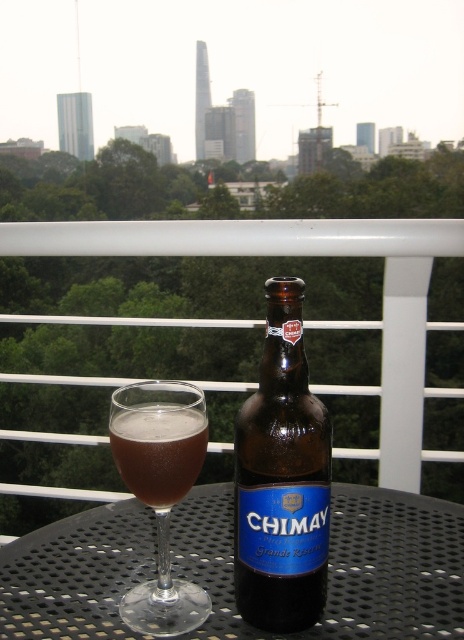
Question: Is brown glass bottle at center to the left of brown glass at center from the viewer's perspective?

Choices:
 (A) no
 (B) yes

Answer: (A)

Question: Which object is positioned closest to the brown glass at center?

Choices:
 (A) transparent glass at center
 (B) brown glass bottle at center
 (C) black metal table at center

Answer: (A)

Question: Does transparent glass at center appear under brown glass at center?

Choices:
 (A) yes
 (B) no

Answer: (A)

Question: Which object appears closest to the camera in this image?

Choices:
 (A) brown glass at center
 (B) transparent glass at center
 (C) black metal table at center
 (D) brown glass bottle at center

Answer: (D)

Question: Can you confirm if transparent glass at center is positioned to the left of brown glass at center?

Choices:
 (A) no
 (B) yes

Answer: (B)

Question: Which point is farther to the camera?

Choices:
 (A) transparent glass at center
 (B) brown glass at center
 (C) brown glass bottle at center
 (D) black metal table at center

Answer: (D)